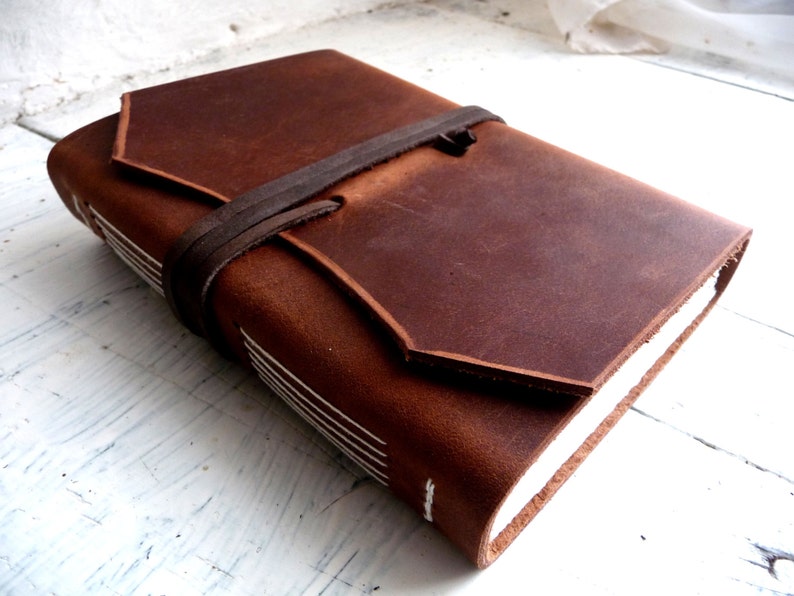
Identify the location of edge of book flap. Image resolution: width=794 pixels, height=596 pixels. (313, 252).